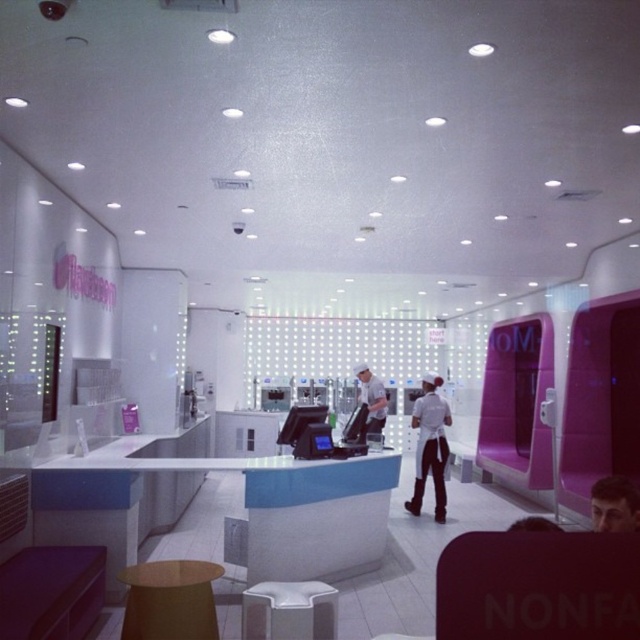
Where is `white fabric apron at center`? The image size is (640, 640). white fabric apron at center is located at coordinates (429, 445).

Where is `white fabric apron at center`? white fabric apron at center is located at coordinates (429, 445).

Between white fabric apron at center and smooth skin face at center, which one is positioned lower?

Positioned lower is white fabric apron at center.

Is point (435, 422) closer to camera compared to point (624, 516)?

No, it is not.

Between point (433, 416) and point (625, 480), which one is positioned behind?

Positioned behind is point (433, 416).

I want to click on white fabric apron at center, so click(x=429, y=445).

Describe the element at coordinates (170, 600) in the screenshot. I see `brown leather stool at lower center` at that location.

What do you see at coordinates (170, 600) in the screenshot? The width and height of the screenshot is (640, 640). I see `brown leather stool at lower center` at bounding box center [170, 600].

Locate an element on the screen. Image resolution: width=640 pixels, height=640 pixels. brown leather stool at lower center is located at coordinates (170, 600).